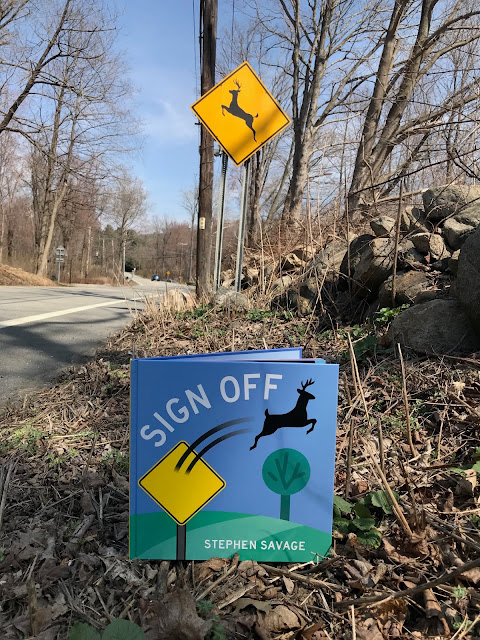
Locate an element on the screen. book is located at coordinates (257, 465).